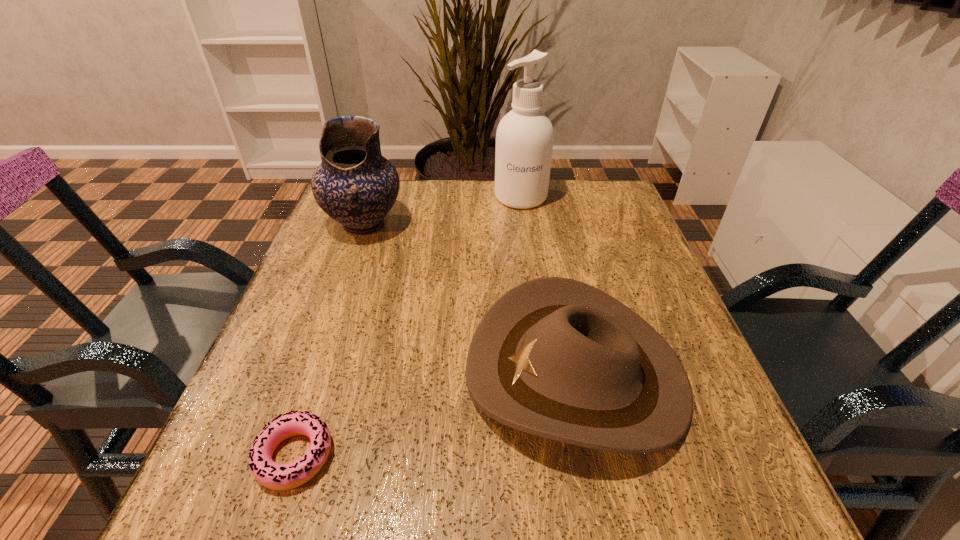
I want to click on blank space at the far edge of the desktop, so click(516, 214).

Locate an element on the screen. Image resolution: width=960 pixels, height=540 pixels. free region at the near edge of the desktop is located at coordinates (641, 496).

Locate an element on the screen. vacant space at the left edge of the desktop is located at coordinates click(x=283, y=462).

The height and width of the screenshot is (540, 960). Find the location of `vacant space at the right edge`. vacant space at the right edge is located at coordinates (699, 440).

In the image, there is a desktop. Identify the location of vacant space at the far right corner. (586, 185).

Identify the location of vacant area at the near right corner. The image size is (960, 540). (750, 472).

Image resolution: width=960 pixels, height=540 pixels. In order to click on vacant space in between the tallest object and the doughnut in this screenshot , I will do `click(408, 326)`.

At what (x,y) coordinates should I click in order to perform the action: click on vacant space that is in between the third tallest object and the third shortest object. Please return your answer as a coordinate pair (x, y). Image resolution: width=960 pixels, height=540 pixels. Looking at the image, I should click on (470, 299).

Where is `vacant area between the pottery and the cowboy hat`? vacant area between the pottery and the cowboy hat is located at coordinates (470, 299).

In order to click on vacant area between the shortest object and the second tallest object in this screenshot , I will do `click(330, 340)`.